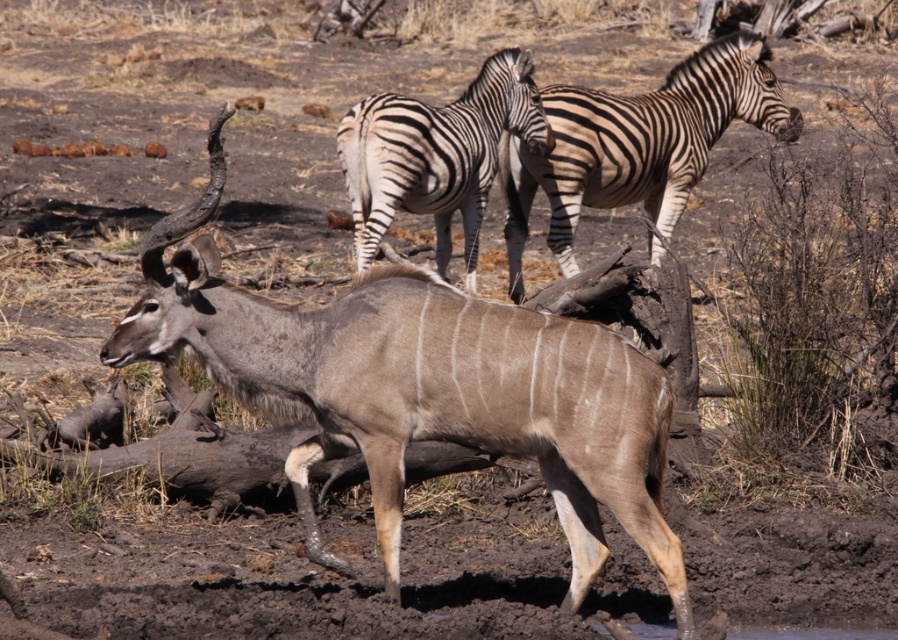
Question: Which object appears farthest from the camera in this image?

Choices:
 (A) gray textured antelope at center
 (B) black and white striped zebra at center

Answer: (B)

Question: Which object is closer to the camera taking this photo?

Choices:
 (A) gray textured antelope at center
 (B) black and white striped zebra at center
 (C) black and white striped zebra at upper center

Answer: (A)

Question: Can you confirm if black and white striped zebra at upper center is positioned to the right of black and white striped zebra at center?

Choices:
 (A) yes
 (B) no

Answer: (A)

Question: Estimate the real-world distances between objects in this image. Which object is closer to the black and white striped zebra at center?

Choices:
 (A) gray textured antelope at center
 (B) black and white striped zebra at upper center

Answer: (B)

Question: Can you confirm if gray textured antelope at center is thinner than black and white striped zebra at upper center?

Choices:
 (A) no
 (B) yes

Answer: (B)

Question: In this image, where is gray textured antelope at center located relative to black and white striped zebra at center?

Choices:
 (A) above
 (B) below

Answer: (B)